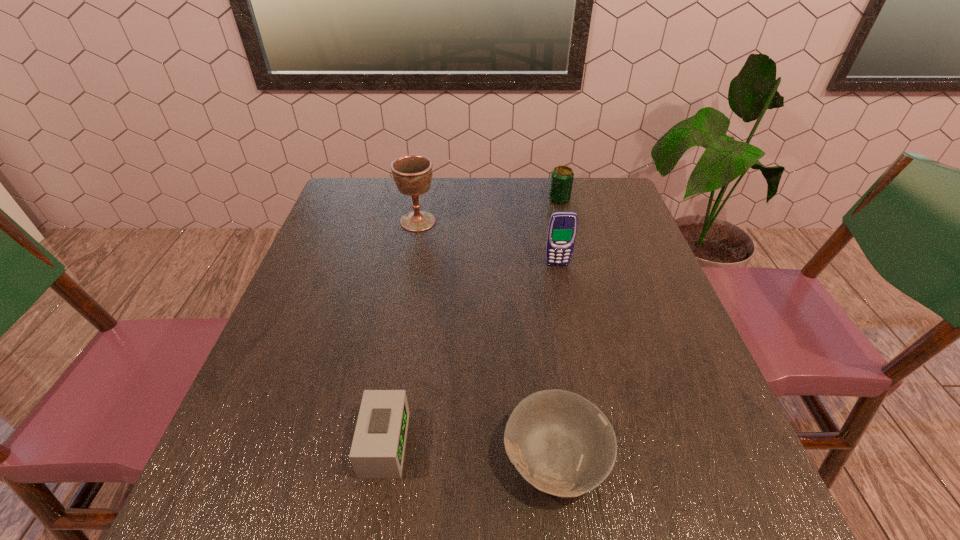
This screenshot has height=540, width=960. Find the location of `vacant area located 0.190m on the left of the bowl`. vacant area located 0.190m on the left of the bowl is located at coordinates (389, 457).

Image resolution: width=960 pixels, height=540 pixels. In order to click on chalice that is at the far edge in this screenshot , I will do `click(412, 174)`.

At what (x,y) coordinates should I click in order to perform the action: click on beer can located at the far edge. Please return your answer as a coordinate pair (x, y). Looking at the image, I should click on (562, 177).

What are the coordinates of `alarm clock located in the near edge section of the desktop` in the screenshot? It's located at (377, 452).

Where is `bowl that is at the near edge`? bowl that is at the near edge is located at coordinates (562, 444).

Identify the location of vacant area at the far edge of the desktop. (395, 193).

Identify the location of free spot at the left edge of the desktop. (339, 271).

You are a GUI agent. You are given a task and a screenshot of the screen. Output one action in this format:
    pyautogui.click(x=<x>, y=<y>)
    Task: Click on the vacant space at the right edge
    The height and width of the screenshot is (540, 960).
    Given the screenshot: What is the action you would take?
    pos(614,293)

The height and width of the screenshot is (540, 960). I want to click on vacant region at the far left corner of the desktop, so click(368, 203).

Locate an element on the screen. The width and height of the screenshot is (960, 540). vacant space at the far right corner is located at coordinates (606, 178).